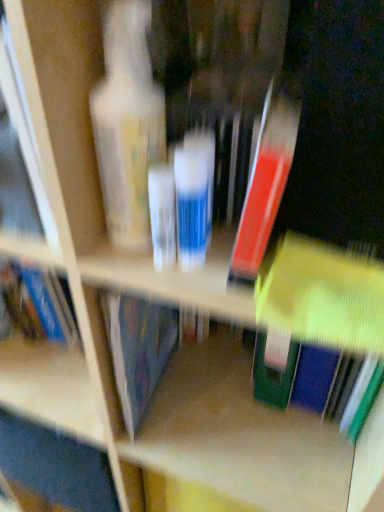
Question: Is matte red book at center, marked as the 2th book in a bottom-to-top arrangement, taller than translucent plastic tube at center?

Choices:
 (A) yes
 (B) no

Answer: (A)

Question: From a real-world perspective, is matte red book at center, marked as the 2th book in a bottom-to-top arrangement, on top of translucent plastic tube at center?

Choices:
 (A) no
 (B) yes

Answer: (B)

Question: Is matte red book at center, positioned as the first book in top-to-bottom order, positioned with its back to translucent plastic tube at center?

Choices:
 (A) yes
 (B) no

Answer: (B)

Question: From a real-world perspective, does matte red book at center, marked as the 2th book in a bottom-to-top arrangement, sit lower than translucent plastic tube at center?

Choices:
 (A) no
 (B) yes

Answer: (A)

Question: Is matte red book at center, marked as the 2th book in a bottom-to-top arrangement, not within translucent plastic tube at center?

Choices:
 (A) no
 (B) yes

Answer: (B)

Question: Is matte red book at center, positioned as the first book in top-to-bottom order, surrounding translucent plastic tube at center?

Choices:
 (A) yes
 (B) no

Answer: (B)

Question: Can you confirm if matte plastic bottle at left is thinner than matte yellow book at center, which appears as the 2th book when viewed from the top?

Choices:
 (A) no
 (B) yes

Answer: (A)

Question: Is matte plastic bottle at left at the right side of matte yellow book at center, which appears as the 2th book when viewed from the top?

Choices:
 (A) yes
 (B) no

Answer: (B)

Question: Is matte plastic bottle at left positioned far away from matte yellow book at center, which appears as the 2th book when viewed from the top?

Choices:
 (A) yes
 (B) no

Answer: (B)

Question: Is matte yellow book at center, placed as the 1th book when sorted from bottom to top, inside matte plastic bottle at left?

Choices:
 (A) yes
 (B) no

Answer: (B)

Question: From a real-world perspective, is matte plastic bottle at left physically below matte yellow book at center, placed as the 1th book when sorted from bottom to top?

Choices:
 (A) yes
 (B) no

Answer: (B)

Question: Is matte plastic bottle at left oriented away from matte yellow book at center, placed as the 1th book when sorted from bottom to top?

Choices:
 (A) yes
 (B) no

Answer: (B)

Question: Is matte red book at center, positioned as the first book in top-to-bottom order, far away from matte plastic bottle at left?

Choices:
 (A) yes
 (B) no

Answer: (B)